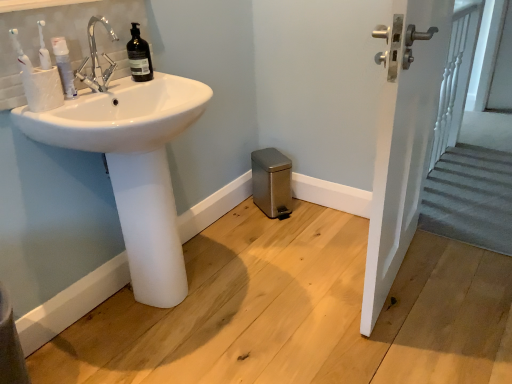
Where is `free space underneath white glossy sink at left (from a real-world perspective)`? free space underneath white glossy sink at left (from a real-world perspective) is located at coordinates (173, 299).